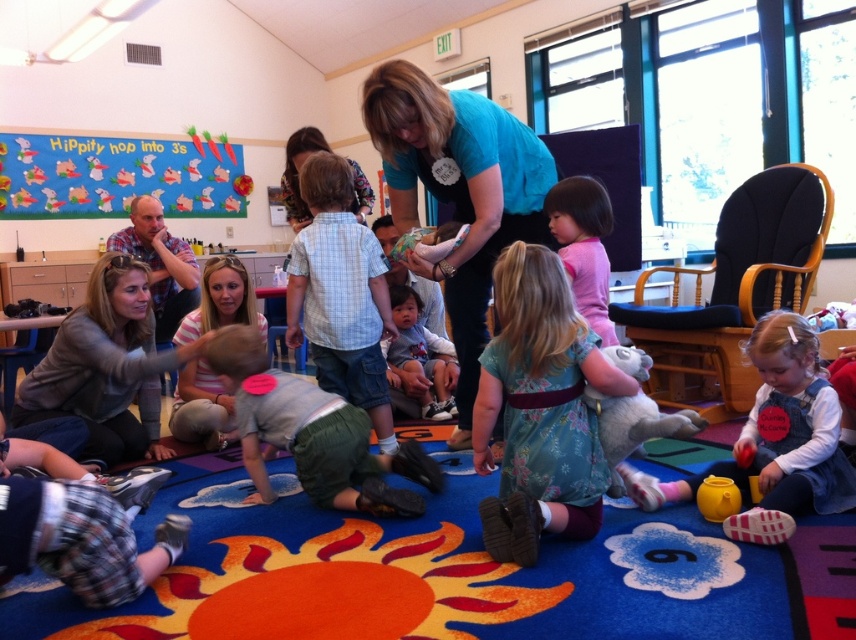
You are standing at the entrance of the classroom and see the striped cotton shirt at center. If you want to walk directly to it, which direction should you head towards?

The striped cotton shirt at center is located at point (201,406), so you should head towards the center of the room to reach it.

You are a teacher organizing a classroom activity. You see two children wearing the blue cotton shirt at center and the gray cotton shirt at center. If you want to seat them side by side on a bench that can only accommodate the width of the wider child, which child should you seat first?

The gray cotton shirt at center is wider than the blue cotton shirt at center. Therefore, you should seat the child wearing the gray cotton shirt at center first to ensure they fit on the bench.

Based on the photo, you are a child in the classroom looking at the pink matte dress at center and the fluffy plush koala at lower center. Which object is closer to the bulletin board on the left wall?

The pink matte dress at center is closer to the bulletin board on the left wall because it is positioned to the left of the fluffy plush koala at lower center.